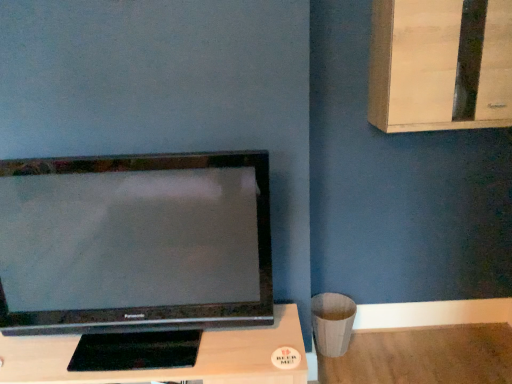
Question: Is the position of black matte tv at center less distant than that of light wood dresser at upper right?

Choices:
 (A) no
 (B) yes

Answer: (B)

Question: Does black matte tv at center have a greater width compared to light wood dresser at upper right?

Choices:
 (A) no
 (B) yes

Answer: (B)

Question: From the image's perspective, is black matte tv at center located above light wood dresser at upper right?

Choices:
 (A) no
 (B) yes

Answer: (A)

Question: Is black matte tv at center facing away from light wood dresser at upper right?

Choices:
 (A) yes
 (B) no

Answer: (B)

Question: From the image's perspective, is black matte tv at center located beneath light wood dresser at upper right?

Choices:
 (A) no
 (B) yes

Answer: (B)

Question: Is black matte tv at center further to camera compared to light wood dresser at upper right?

Choices:
 (A) no
 (B) yes

Answer: (A)

Question: Does black matte tv at center have a greater width compared to satin black television at left?

Choices:
 (A) no
 (B) yes

Answer: (B)

Question: Is black matte tv at center next to satin black television at left and touching it?

Choices:
 (A) yes
 (B) no

Answer: (B)

Question: Is satin black television at left completely or partially inside black matte tv at center?

Choices:
 (A) yes
 (B) no

Answer: (B)

Question: Is black matte tv at center to the right of satin black television at left from the viewer's perspective?

Choices:
 (A) yes
 (B) no

Answer: (A)

Question: Does black matte tv at center have a lesser height compared to satin black television at left?

Choices:
 (A) yes
 (B) no

Answer: (A)

Question: Could you tell me if black matte tv at center is facing satin black television at left?

Choices:
 (A) yes
 (B) no

Answer: (B)

Question: Is satin black television at left far from light wood dresser at upper right?

Choices:
 (A) yes
 (B) no

Answer: (B)